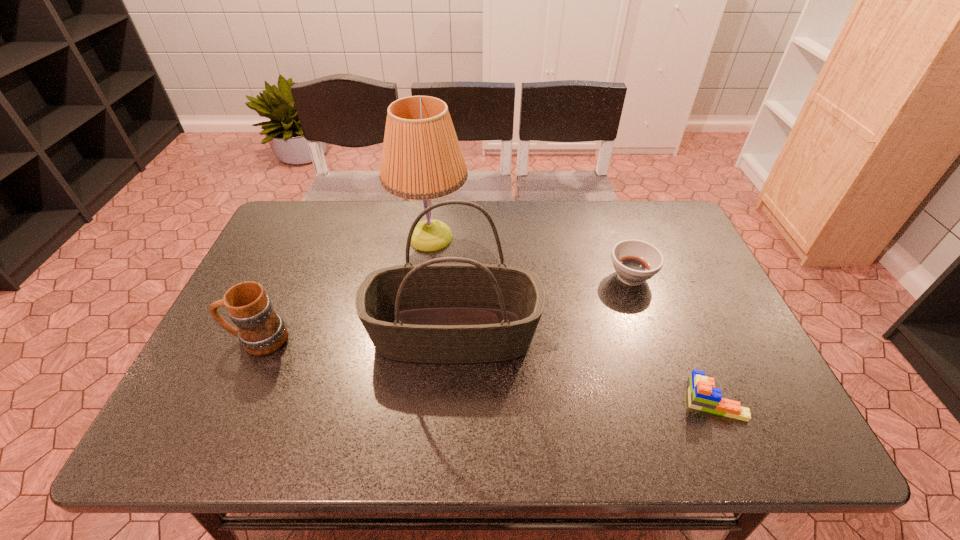
Identify the location of the tallest object. The height and width of the screenshot is (540, 960). (421, 159).

Locate an element on the screen. This screenshot has width=960, height=540. the fourth shortest object is located at coordinates (452, 313).

The height and width of the screenshot is (540, 960). I want to click on the leftmost object, so point(261,331).

I want to click on mug, so click(x=261, y=331).

Identify the location of soup bowl. The width and height of the screenshot is (960, 540). coord(635,261).

Find the location of a particular element. The height and width of the screenshot is (540, 960). the nearest object is located at coordinates point(702,395).

You are a GUI agent. You are given a task and a screenshot of the screen. Output one action in this format:
    pyautogui.click(x=<x>, y=<y>)
    Task: Click on the vacant space located on the side of the tallest object near the pull switch
    
    Given the screenshot: What is the action you would take?
    534,237

Find the location of a particular element. The image size is (960, 540). vacant space located on the right of the basket is located at coordinates (624, 334).

Locate an element on the screen. This screenshot has width=960, height=540. free region located on the back of the soup bowl is located at coordinates (604, 200).

This screenshot has height=540, width=960. In order to click on free space located 0.300m on the back of the Lego in this screenshot , I will do [x=665, y=287].